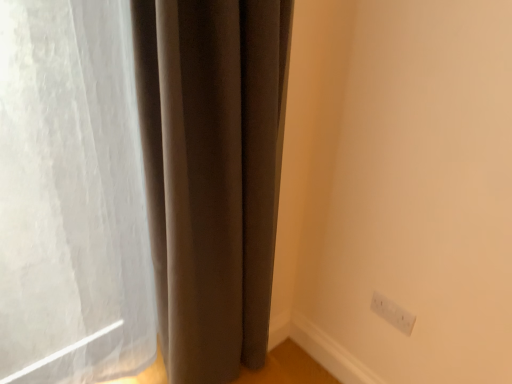
Locate an element on the screen. This screenshot has width=512, height=384. dark grey velvet curtains at center is located at coordinates (138, 185).

What is the approximate height of dark grey velvet curtains at center?

1.33 meters.

This screenshot has height=384, width=512. Describe the element at coordinates (138, 185) in the screenshot. I see `dark grey velvet curtains at center` at that location.

Where is `dark grey velvet curtains at center`? Image resolution: width=512 pixels, height=384 pixels. dark grey velvet curtains at center is located at coordinates (138, 185).